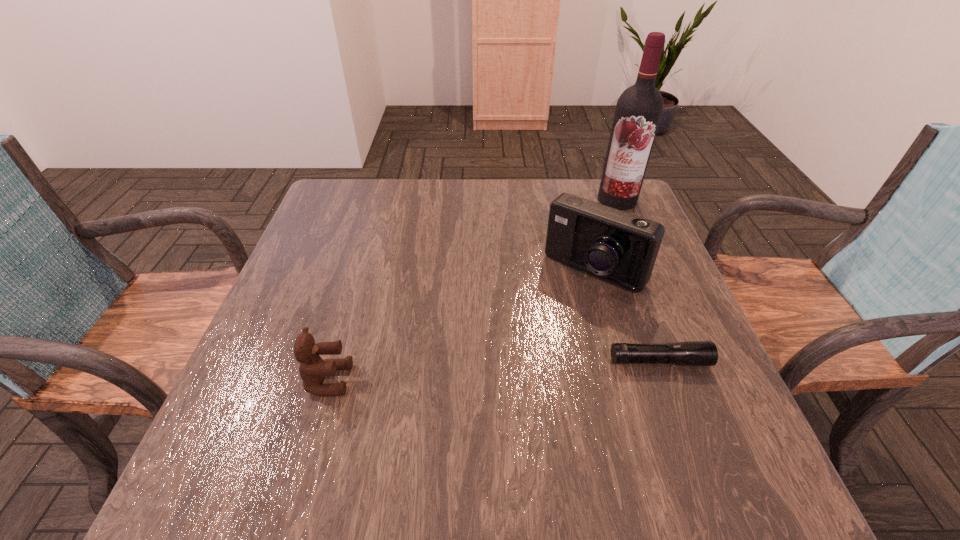
Locate an element on the screen. The width and height of the screenshot is (960, 540). the third tallest object is located at coordinates (313, 369).

Find the location of a particular element. The height and width of the screenshot is (540, 960). the leftmost object is located at coordinates (313, 369).

The image size is (960, 540). I want to click on flashlight, so click(x=693, y=353).

The width and height of the screenshot is (960, 540). I want to click on the farthest object, so [x=639, y=108].

The height and width of the screenshot is (540, 960). I want to click on wine bottle, so click(x=639, y=108).

Locate an element on the screen. This screenshot has height=540, width=960. the third shortest object is located at coordinates (616, 246).

Where is `the second farthest object`? The image size is (960, 540). the second farthest object is located at coordinates (616, 246).

Where is `blank space located 0.170m on the face of the second shortest object`? blank space located 0.170m on the face of the second shortest object is located at coordinates (440, 380).

I want to click on vacant position located on the label of the farthest object, so click(x=581, y=244).

The width and height of the screenshot is (960, 540). I want to click on blank space located on the label of the farthest object, so click(x=581, y=244).